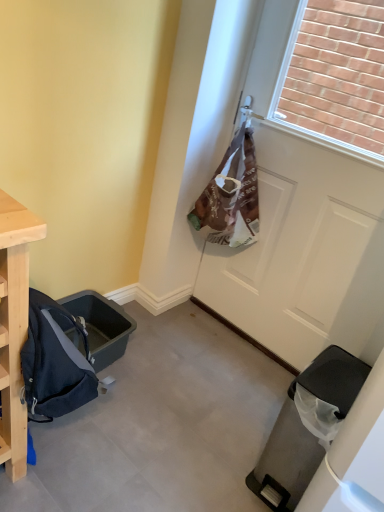
Where is `white matte door at center`? Image resolution: width=384 pixels, height=512 pixels. white matte door at center is located at coordinates (306, 251).

What do you see at coordinates (306, 251) in the screenshot? I see `white matte door at center` at bounding box center [306, 251].

What is the approximate height of white matte door at center?

white matte door at center is 1.42 meters in height.

What is the approximate width of black plastic trash can at lower right?

black plastic trash can at lower right is 15.64 inches in width.

Describe the element at coordinates (306, 426) in the screenshot. I see `black plastic trash can at lower right` at that location.

The image size is (384, 512). In order to click on black plastic trash can at lower right in this screenshot , I will do `click(306, 426)`.

At what (x,y) coordinates should I click in order to perform the action: click on white matte door at center. Please return your answer as a coordinate pair (x, y). Looking at the image, I should click on (306, 251).

Would you say black plastic trash can at lower right is to the left or to the right of white matte door at center in the picture?

black plastic trash can at lower right is to the left of white matte door at center.

Does black plastic trash can at lower right come in front of white matte door at center?

Yes, it is.

Is point (303, 451) positioned in front of point (298, 298)?

Yes, point (303, 451) is in front of point (298, 298).

Looking at this image, from the image's perspective, between black plastic trash can at lower right and white matte door at center, who is located below?

black plastic trash can at lower right appears lower in the image.

From a real-world perspective, relative to white matte door at center, is black plastic trash can at lower right vertically above or below?

In terms of real-world spatial position, black plastic trash can at lower right is below white matte door at center.

Which of these two, black plastic trash can at lower right or white matte door at center, is wider?

black plastic trash can at lower right.

Considering the relative sizes of black plastic trash can at lower right and white matte door at center in the image provided, is black plastic trash can at lower right taller than white matte door at center?

No, black plastic trash can at lower right is not taller than white matte door at center.

Can you confirm if black plastic trash can at lower right is smaller than white matte door at center?

Indeed, black plastic trash can at lower right has a smaller size compared to white matte door at center.

Is white matte door at center located within black plastic trash can at lower right?

No, white matte door at center is not inside black plastic trash can at lower right.

Are black plastic trash can at lower right and white matte door at center beside each other?

No, black plastic trash can at lower right is not making contact with white matte door at center.

Could you tell me if black plastic trash can at lower right is turned towards white matte door at center?

No, black plastic trash can at lower right is not aimed at white matte door at center.

What's the angular difference between black plastic trash can at lower right and white matte door at center's facing directions?

The facing directions of black plastic trash can at lower right and white matte door at center are 0.436 degrees apart.

Measure the distance between black plastic trash can at lower right and white matte door at center.

The distance of black plastic trash can at lower right from white matte door at center is 23.21 inches.

Where is `door that appears above the black plastic trash can at lower right (from a real-world perspective)`? The height and width of the screenshot is (512, 384). door that appears above the black plastic trash can at lower right (from a real-world perspective) is located at coordinates (306, 251).

Considering the relative positions of white matte door at center and black plastic trash can at lower right in the image provided, is white matte door at center to the left or to the right of black plastic trash can at lower right?

white matte door at center is positioned on black plastic trash can at lower right's right side.

Considering the positions of objects white matte door at center and black plastic trash can at lower right in the image provided, who is in front, white matte door at center or black plastic trash can at lower right?

black plastic trash can at lower right.

Which point is more distant from viewer, (369, 202) or (327, 387)?

The point (369, 202) is farther from the camera.

From the image's perspective, is white matte door at center located above or below black plastic trash can at lower right?

From the image's perspective, white matte door at center appears above black plastic trash can at lower right.

From a real-world perspective, who is located higher, white matte door at center or black plastic trash can at lower right?

white matte door at center, from a real-world perspective.

Does white matte door at center have a lesser width compared to black plastic trash can at lower right?

Correct, the width of white matte door at center is less than that of black plastic trash can at lower right.

Between white matte door at center and black plastic trash can at lower right, which one has less height?

black plastic trash can at lower right is shorter.

Is white matte door at center bigger than black plastic trash can at lower right?

Yes.

Consider the image. Is white matte door at center not inside black plastic trash can at lower right?

Absolutely, white matte door at center is external to black plastic trash can at lower right.

Is white matte door at center not close to black plastic trash can at lower right?

No, white matte door at center is in close proximity to black plastic trash can at lower right.

Could you tell me if white matte door at center is facing black plastic trash can at lower right?

No, white matte door at center is not turned towards black plastic trash can at lower right.

This screenshot has height=512, width=384. In order to click on door above the black plastic trash can at lower right (from the image's perspective) in this screenshot , I will do `click(306, 251)`.

Find the location of a particular element. door on the right side of black plastic trash can at lower right is located at coordinates (306, 251).

Where is `trash bin/can lying in front of the white matte door at center`? This screenshot has height=512, width=384. trash bin/can lying in front of the white matte door at center is located at coordinates 306,426.